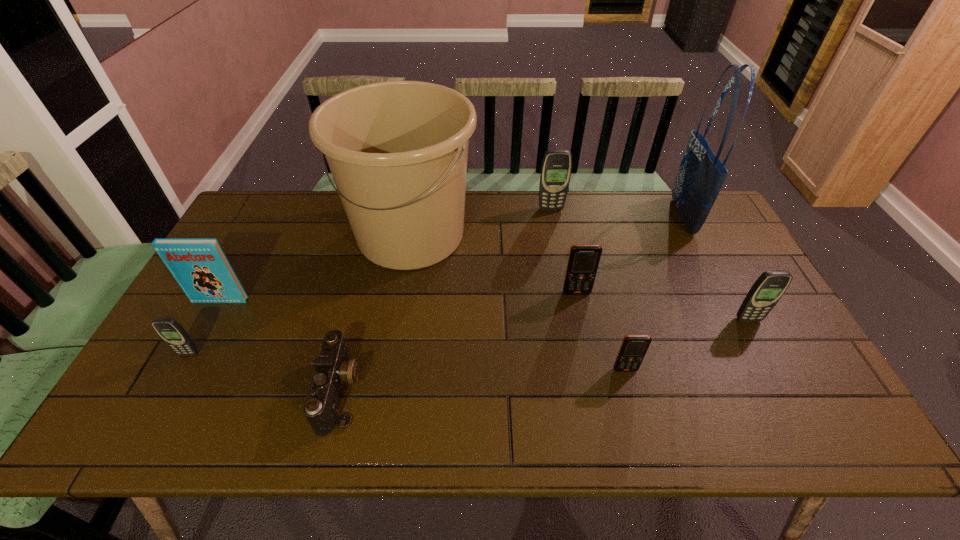
Identify the location of the fourth nearest cellular telephone. (583, 262).

Locate an element on the screen. the right orange cellular telephone is located at coordinates (634, 347).

Where is `the nearer orange cellular telephone`? the nearer orange cellular telephone is located at coordinates (634, 347).

Identify the location of the leftmost cellular telephone. (173, 334).

I want to click on the nearest gray cellular telephone, so click(173, 334).

Find the location of a particular element. The image size is (960, 540). camera is located at coordinates (333, 368).

Locate an element on the screen. free point located 0.140m on the front-facing side of the tallest object is located at coordinates (x=634, y=216).

Where is `free space located on the front-facing side of the tallest object`? free space located on the front-facing side of the tallest object is located at coordinates (654, 216).

Where is `free location located on the front-facing side of the tallest object`? Image resolution: width=960 pixels, height=540 pixels. free location located on the front-facing side of the tallest object is located at coordinates (584, 216).

Locate an element on the screen. The image size is (960, 540). vacant space positioned on the front of the beige bucket is located at coordinates (386, 383).